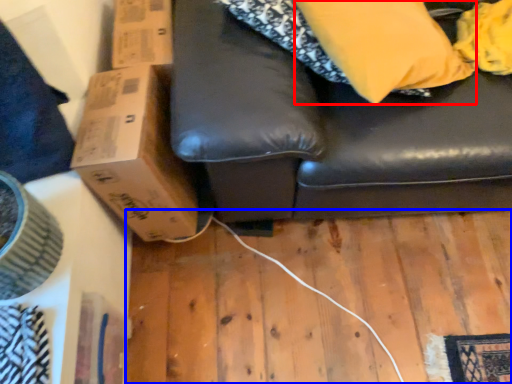
Question: Among these objects, which one is nearest to the camera, pillow (highlighted by a red box) or plywood (highlighted by a blue box)?

Choices:
 (A) pillow
 (B) plywood

Answer: (A)